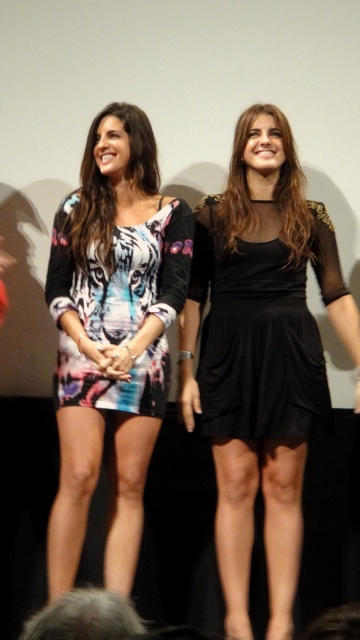
Consider the image. Between printed fabric dress at left and printed fabric dress at center, which one appears on the right side from the viewer's perspective?

Positioned to the right is printed fabric dress at left.

Which is behind, point (146, 392) or point (136, 237)?

Point (136, 237)

Identify the location of printed fabric dress at left. (111, 333).

Describe the element at coordinates (261, 362) in the screenshot. I see `black velvet dress at center` at that location.

Is point (281, 221) closer to viewer compared to point (267, 362)?

That is False.

Find the location of a particular element. Image resolution: width=360 pixels, height=640 pixels. black velvet dress at center is located at coordinates (261, 362).

Who is more forward, (149, 378) or (290, 410)?

Point (149, 378)

In the scene shown: Who is positioned more to the left, printed fabric dress at left or black sheer dress at center?

From the viewer's perspective, printed fabric dress at left appears more on the left side.

Is point (96, 317) farther from viewer compared to point (236, 388)?

No, it is not.

Locate an element on the screen. The image size is (360, 640). printed fabric dress at left is located at coordinates click(111, 333).